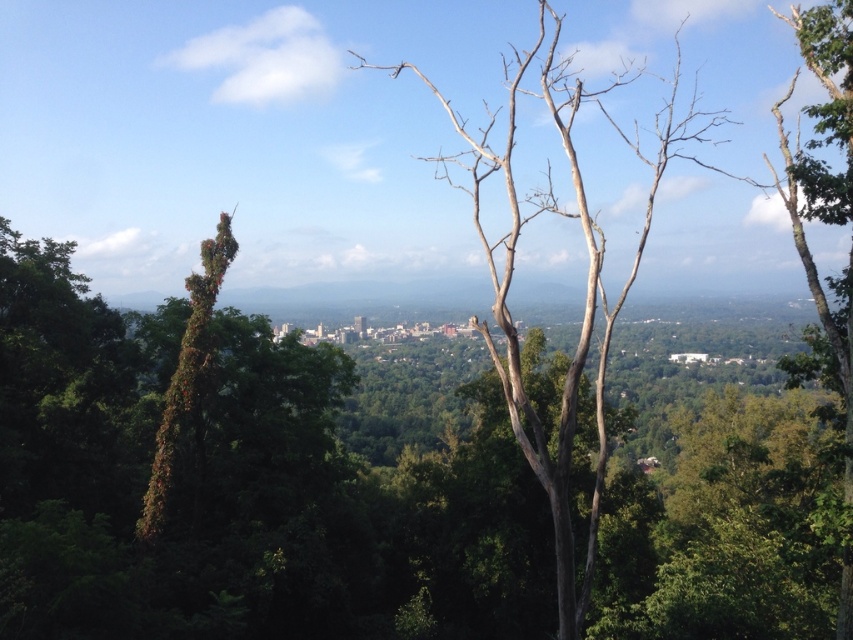
Is point (65, 451) positioned in front of point (473, 188)?

Yes, point (65, 451) is in front of point (473, 188).

Can you confirm if green leafy tree at center is positioned above bare wood tree at center?

No.

Between point (535, 630) and point (560, 484), which one is positioned in front?

Positioned in front is point (560, 484).

Find the location of a particular element. The image size is (853, 640). green leafy tree at center is located at coordinates tap(234, 483).